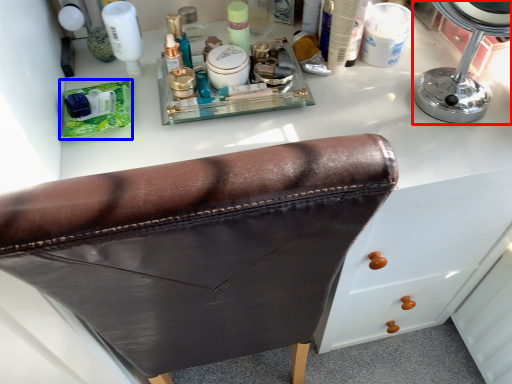
Question: Which point is further to the camera, mirror (highlighted by a red box) or product (highlighted by a blue box)?

Choices:
 (A) mirror
 (B) product

Answer: (B)